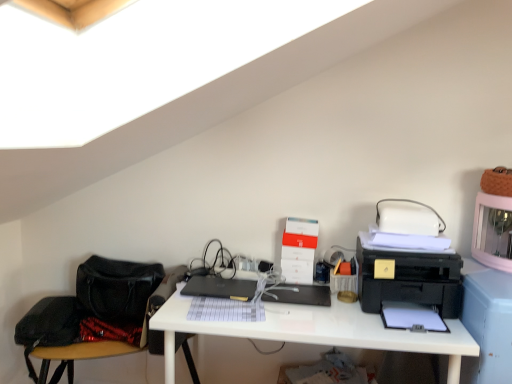
Question: From the image's perspective, is black matte laptop at center positioned above or below black plastic printer at right?

Choices:
 (A) above
 (B) below

Answer: (B)

Question: Considering their positions, is black matte laptop at center located in front of or behind black plastic printer at right?

Choices:
 (A) front
 (B) behind

Answer: (B)

Question: Estimate the real-world distances between objects in this image. Which object is closer to the black plastic register at center?

Choices:
 (A) white glossy desk at center
 (B) black matte laptop at center
 (C) black leather swivel chair at lower left
 (D) black plastic printer at right
 (E) white cardboard box at center

Answer: (E)

Question: Based on their relative distances, which object is nearer to the white cardboard box at center?

Choices:
 (A) white glossy desk at center
 (B) black matte laptop at center
 (C) black leather swivel chair at lower left
 (D) black plastic printer at right
 (E) black plastic register at center

Answer: (E)